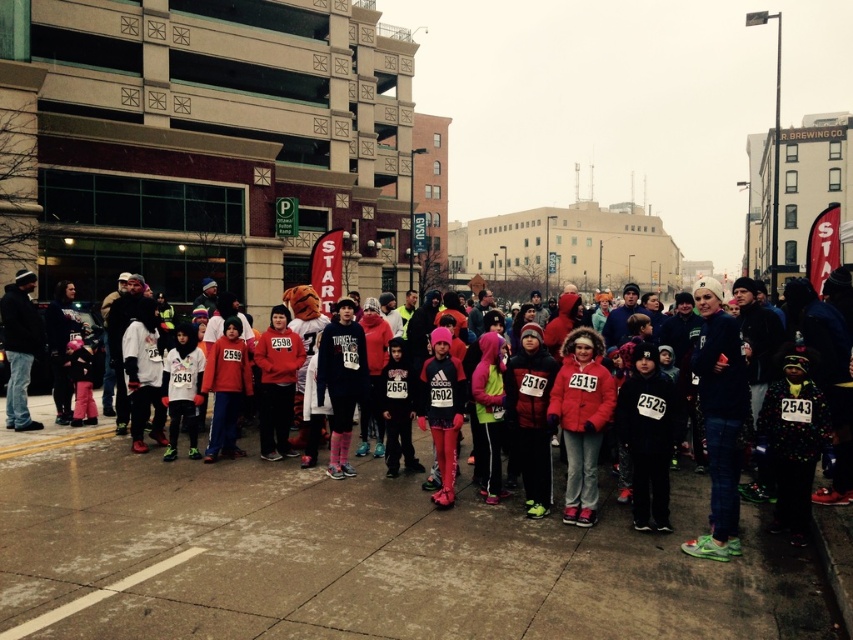
You are a photographer at the community event and you want to take a photo that includes both the matte black hoodie at center and the pink matte leggings at center. Based on their positions, which one should you adjust your camera to focus on first to ensure both are in frame?

The matte black hoodie at center is to the left of the pink matte leggings at center, so you should focus on the pink matte leggings at center first to ensure both are in frame.

Looking at this image, you are a photographer standing at the starting line of the race. You want to capture a photo that includes both the matte red coat at center and the matte black hoodie at center. The camera you are using has a lens with a 120 degree field of view. Knowing that the distance between the two coats is 9.42 feet, can you fit both subjects into the frame without moving the camera?

The distance between the matte red coat at center and the matte black hoodie at center is 9.42 feet. With a 120 degree field of view, the camera can capture a wide angle that easily accommodates the 9.42 feet separation between the two subjects. Therefore, both the matte red coat at center and the matte black hoodie at center can be included in the frame without moving the camera.

You are organizing a photo shoot and need to ensure that all participants are visible in the frame. Given that the matte black hoodie at center and the pink matte leggings at center are both in the center, which one might be easier to capture clearly in a single shot?

The matte black hoodie at center occupies less space than the pink matte leggings at center, so it might be easier to capture clearly in a single shot since it takes up less area and could be framed without overlapping other elements.